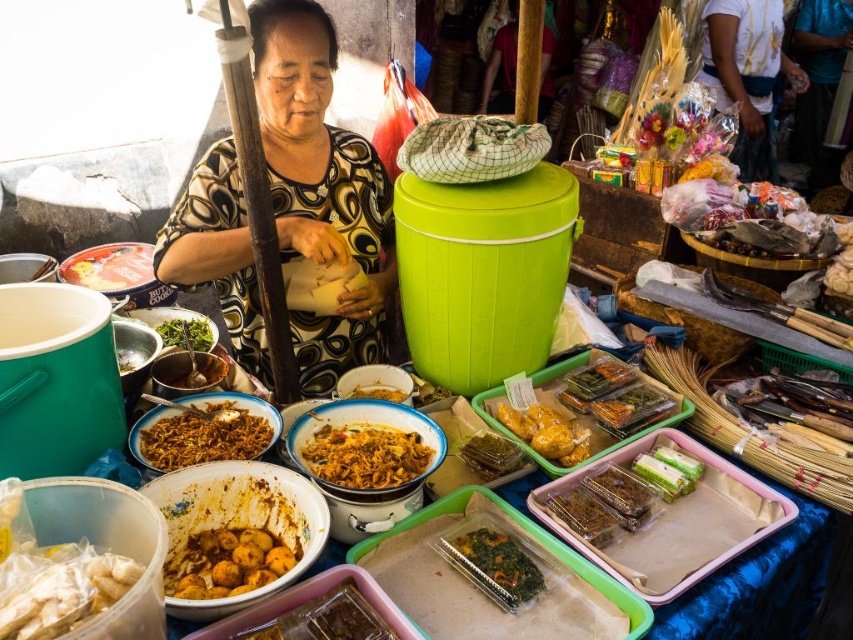
At what (x,y) coordinates should I click in order to perform the action: click on green plastic container at center. Please return your answer as a coordinate pair (x, y). Looking at the image, I should click on (490, 454).

Can you confirm if green plastic container at center is wider than green leafy vegetable at center?

In fact, green plastic container at center might be narrower than green leafy vegetable at center.

Measure the distance between point (474, 464) and camera.

Point (474, 464) and camera are 1.44 meters apart from each other.

Image resolution: width=853 pixels, height=640 pixels. Identify the location of green plastic container at center. (490, 454).

Which of these two, white plastic bag at lower left or brown matte food at lower center, stands taller?

white plastic bag at lower left

The height and width of the screenshot is (640, 853). Describe the element at coordinates (59, 588) in the screenshot. I see `white plastic bag at lower left` at that location.

Between point (28, 605) and point (341, 580), which one is positioned in front?

Point (28, 605) is more forward.

Locate an element on the screen. white plastic bag at lower left is located at coordinates (59, 588).

Is white plastic bag at lower left smaller than green plastic container at center?

Incorrect, white plastic bag at lower left is not smaller in size than green plastic container at center.

Locate an element on the screen. This screenshot has width=853, height=640. white plastic bag at lower left is located at coordinates (59, 588).